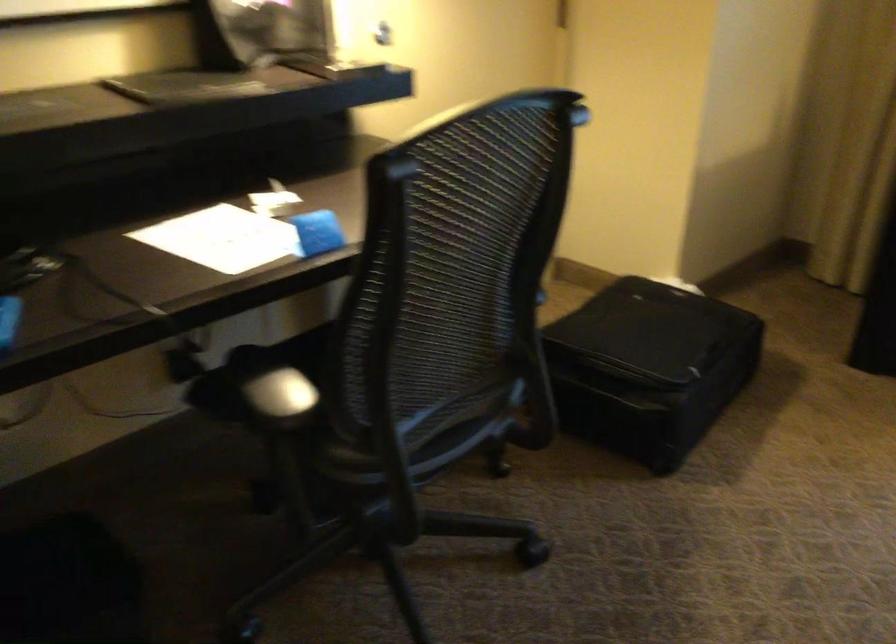
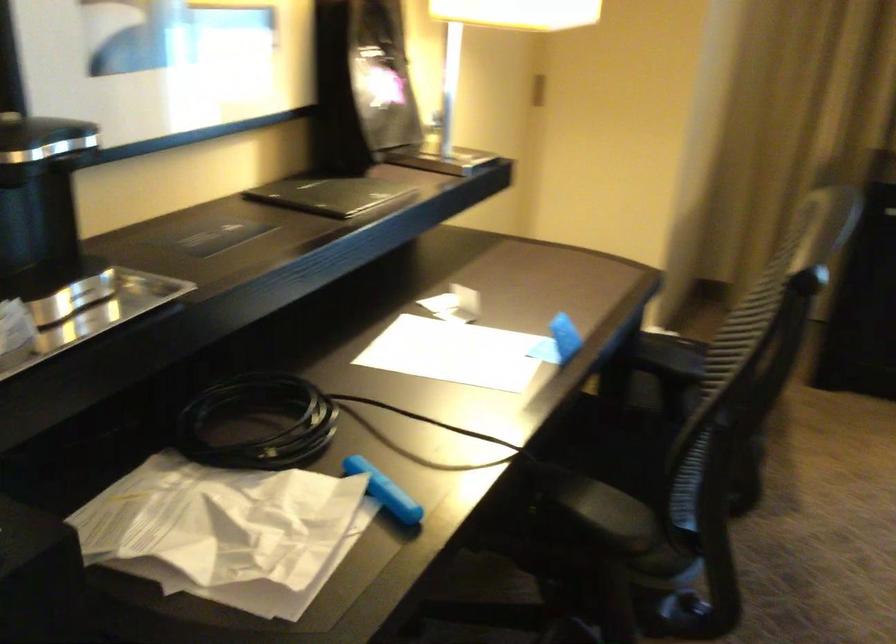
Question: Which direction would the cameraman need to move to produce the second image? Reply with the corresponding letter.

Choices:
 (A) Left
 (B) Right
 (C) Forward
 (D) Backward

Answer: (A)